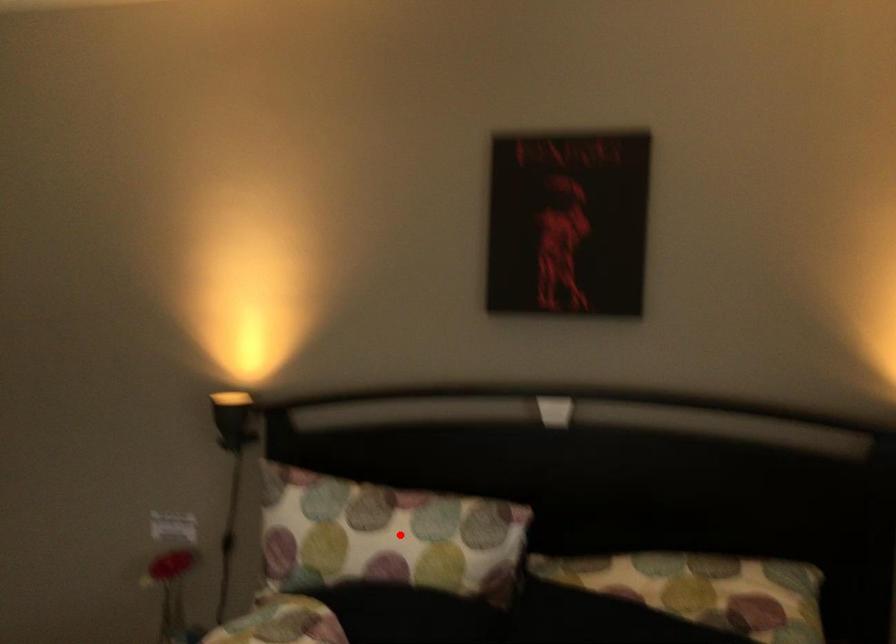
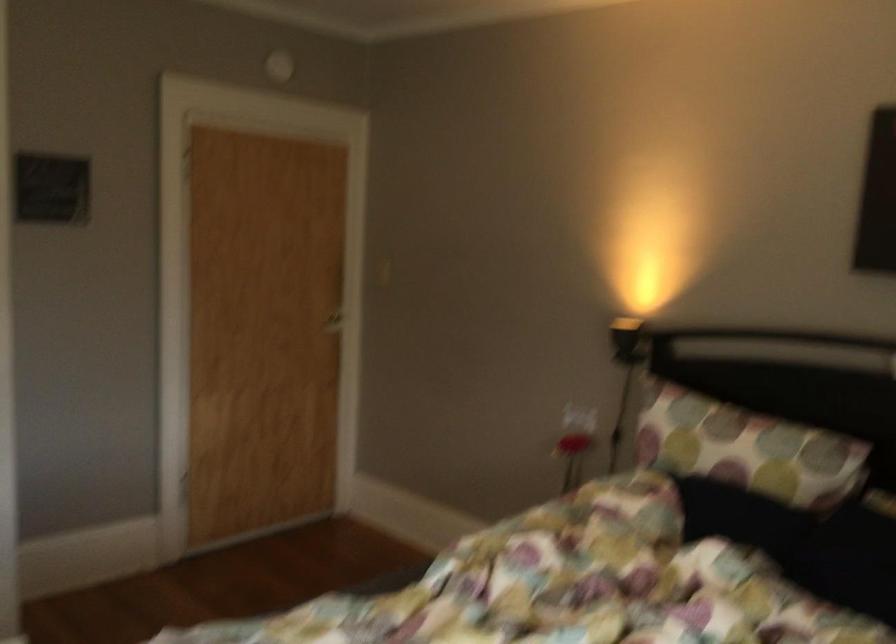
Question: I am providing you with two images of the same scene from different viewpoints. A red point is shown in image1. For the corresponding object point in image2, is it positioned nearer or farther from the camera?

Choices:
 (A) Nearer
 (B) Farther

Answer: (B)